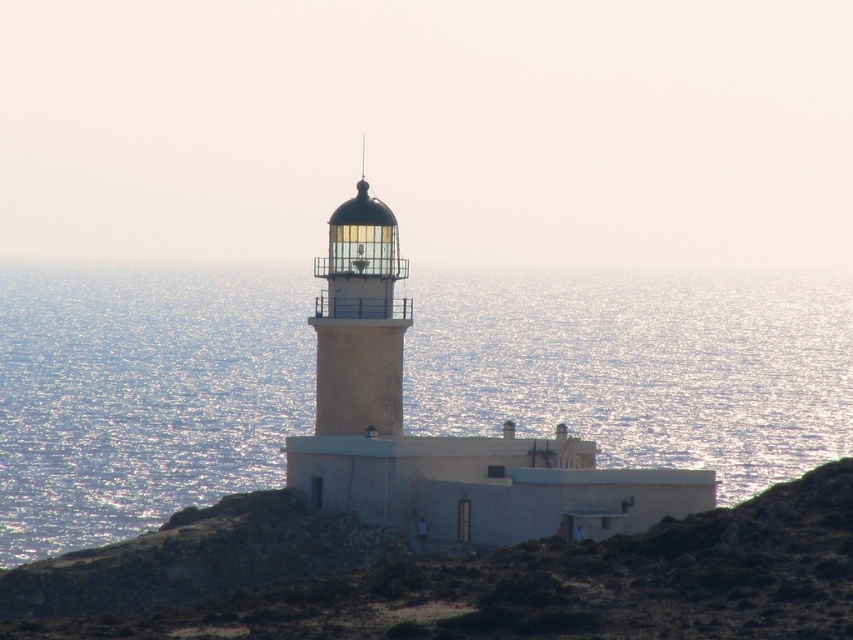
You are standing at the base of the lighthouse and want to climb up to the dome. The brown rocky hillside at center is in your way. Is there enough space to navigate around it?

The brown rocky hillside at center is located at point (453, 577), which means it is positioned to the right side of the lighthouse. Since the lighthouse has a cylindrical base and the hillside is at the center, there should be enough space to navigate around it to reach the dome.

You are a bird flying over the ocean and want to land on the brown rocky hillside at center. Can you see the white concrete lighthouse at center from your landing spot?

Since the brown rocky hillside at center is shorter than the white concrete lighthouse at center, the lighthouse will be visible from the hillside. Therefore, yes, you can see the white concrete lighthouse at center from the brown rocky hillside at center.